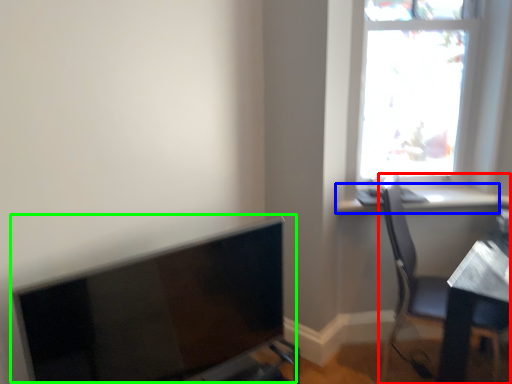
Question: Which object is the farthest from chair (highlighted by a red box)? Choose among these: window sill (highlighted by a blue box) or computer monitor (highlighted by a green box).

Choices:
 (A) window sill
 (B) computer monitor

Answer: (B)